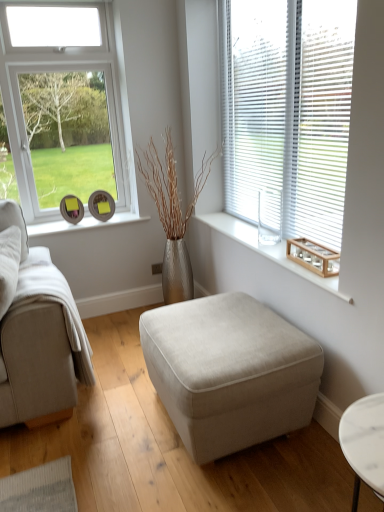
You are a GUI agent. You are given a task and a screenshot of the screen. Output one action in this format:
    pyautogui.click(x=<x>, y=<y>)
    Task: Click on the free space above wooden tray at right (from a real-world perspective)
    
    Given the screenshot: What is the action you would take?
    pyautogui.click(x=265, y=243)